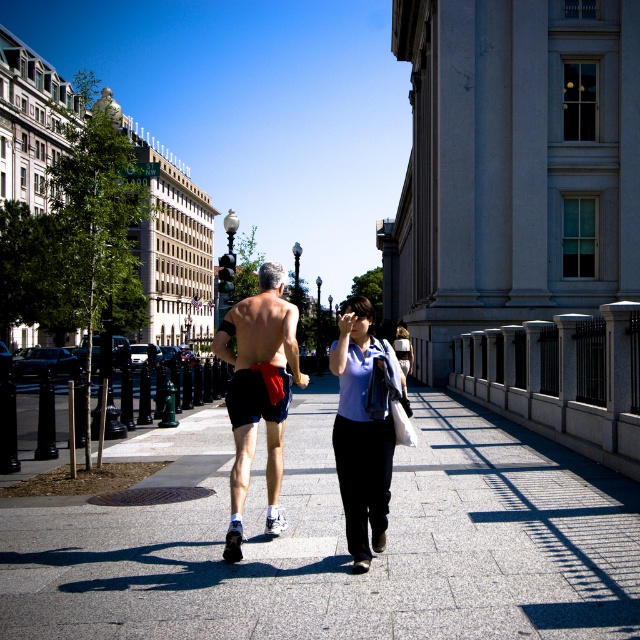
Looking at this image, is matte black shorts at center taller than dark blue shorts at center?

Indeed, matte black shorts at center has a greater height compared to dark blue shorts at center.

Which is more to the right, matte black shorts at center or dark blue shorts at center?

matte black shorts at center is more to the right.

Is point (278, 403) positioned before point (243, 381)?

No.

Identify the location of matte black shorts at center. (x=257, y=392).

Between point (406, 456) and point (381, 515), which one is positioned behind?

The point (406, 456) is more distant.

From the picture: Who is lower down, paved stone sidewalk at center or matte blue shirt at center?

paved stone sidewalk at center is below.

Is point (531, 476) positioned in front of point (374, 502)?

No, (531, 476) is further to viewer.

This screenshot has height=640, width=640. In order to click on paved stone sidewalk at center in this screenshot , I will do `click(339, 540)`.

Which is more to the left, matte black shorts at center or matte blue shirt at center?

matte black shorts at center

Is the position of matte black shorts at center more distant than that of matte blue shirt at center?

Yes, matte black shorts at center is behind matte blue shirt at center.

Is point (390, 460) farther from camera compared to point (346, 444)?

Yes, it is.

You are a GUI agent. You are given a task and a screenshot of the screen. Output one action in this format:
    pyautogui.click(x=<x>, y=<y>)
    Task: Click on the matte black shorts at center
    This screenshot has width=640, height=640.
    Given the screenshot: What is the action you would take?
    pyautogui.click(x=257, y=392)